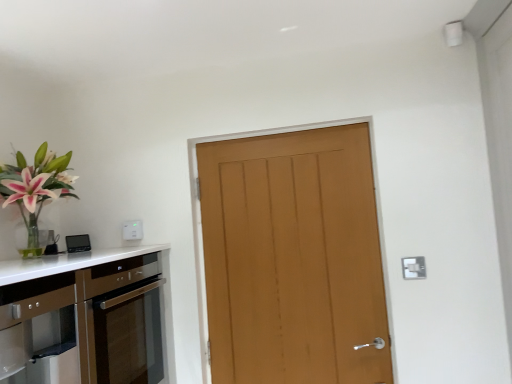
Question: From the image's perspective, relative to white plastic electric outlet at upper right, positioned as the first electric outlet in front-to-back order, is white plastic electric outlet at upper center, marked as the 1th electric outlet in a left-to-right arrangement, above or below?

Choices:
 (A) above
 (B) below

Answer: (A)

Question: Considering the relative positions of white plastic electric outlet at upper center, the 2th electric outlet positioned from the right, and white plastic electric outlet at upper right, which appears as the second electric outlet when viewed from the left, in the image provided, is white plastic electric outlet at upper center, the 2th electric outlet positioned from the right, to the left or to the right of white plastic electric outlet at upper right, which appears as the second electric outlet when viewed from the left,?

Choices:
 (A) left
 (B) right

Answer: (A)

Question: Which is nearer to the satin brown cabinetry at lower left?

Choices:
 (A) white plastic electric outlet at upper right, which appears as the second electric outlet when viewed from the left
 (B) white plastic electric outlet at upper center, the 2th electric outlet viewed from the front
 (C) wooden door at center

Answer: (B)

Question: Considering the real-world distances, which object is closest to the satin brown cabinetry at lower left?

Choices:
 (A) white plastic electric outlet at upper right, positioned as the first electric outlet in front-to-back order
 (B) wooden door at center
 (C) white plastic electric outlet at upper center, the 2th electric outlet positioned from the right

Answer: (C)